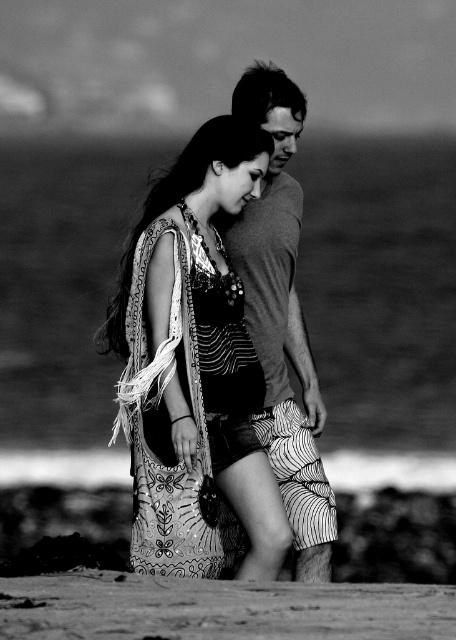
Between patterned fabric dress at center and matte gray t-shirt at center, which one is positioned higher?

patterned fabric dress at center is higher up.

Does patterned fabric dress at center have a smaller size compared to matte gray t-shirt at center?

No.

Image resolution: width=456 pixels, height=640 pixels. Describe the element at coordinates (193, 364) in the screenshot. I see `patterned fabric dress at center` at that location.

Where is `patterned fabric dress at center`? The width and height of the screenshot is (456, 640). patterned fabric dress at center is located at coordinates (193, 364).

Does patterned fabric dress at center lie behind smooth sand at lower center?

Yes, patterned fabric dress at center is further from the viewer.

Is patterned fabric dress at center thinner than smooth sand at lower center?

Yes.

What do you see at coordinates (193, 364) in the screenshot? This screenshot has height=640, width=456. I see `patterned fabric dress at center` at bounding box center [193, 364].

The image size is (456, 640). In order to click on patterned fabric dress at center in this screenshot , I will do `click(193, 364)`.

Who is shorter, smooth sand at lower center or matte gray t-shirt at center?

smooth sand at lower center is shorter.

Is smooth sand at lower center thinner than matte gray t-shirt at center?

Incorrect, smooth sand at lower center's width is not less than matte gray t-shirt at center's.

Which is in front, point (98, 630) or point (267, 428)?

Point (98, 630) is in front.

Locate an element on the screen. This screenshot has height=640, width=456. smooth sand at lower center is located at coordinates (217, 609).